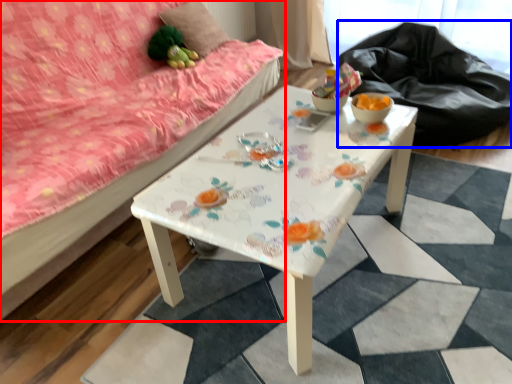
Question: Which of the following is the farthest to the observer, studio couch (highlighted by a red box) or sit (highlighted by a blue box)?

Choices:
 (A) studio couch
 (B) sit

Answer: (B)